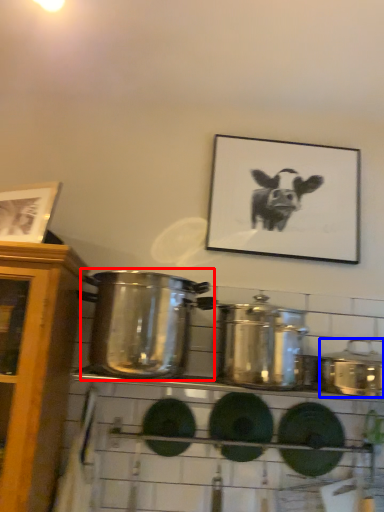
Question: Which object appears closest to the camera in this image, crock pot (highlighted by a red box) or crock pot (highlighted by a blue box)?

Choices:
 (A) crock pot
 (B) crock pot

Answer: (A)